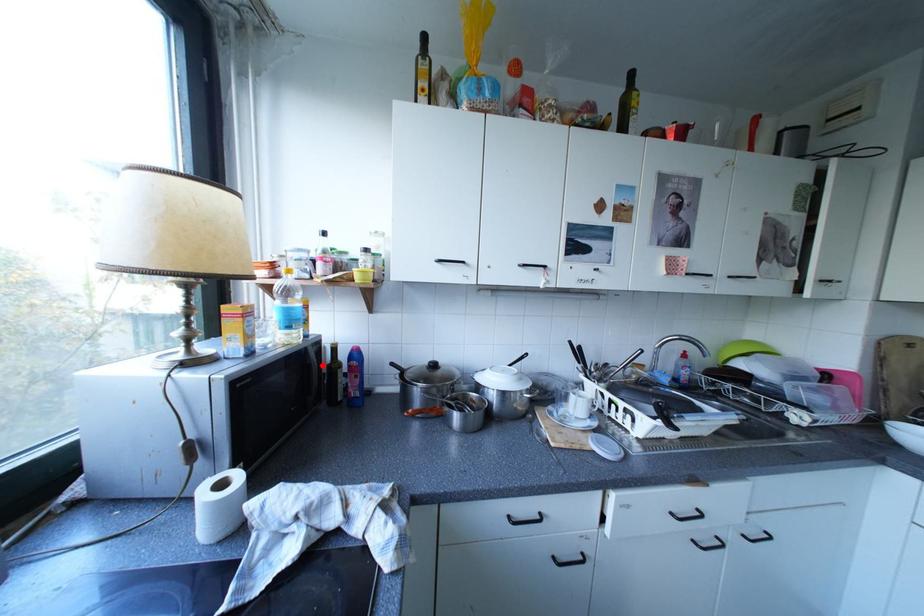
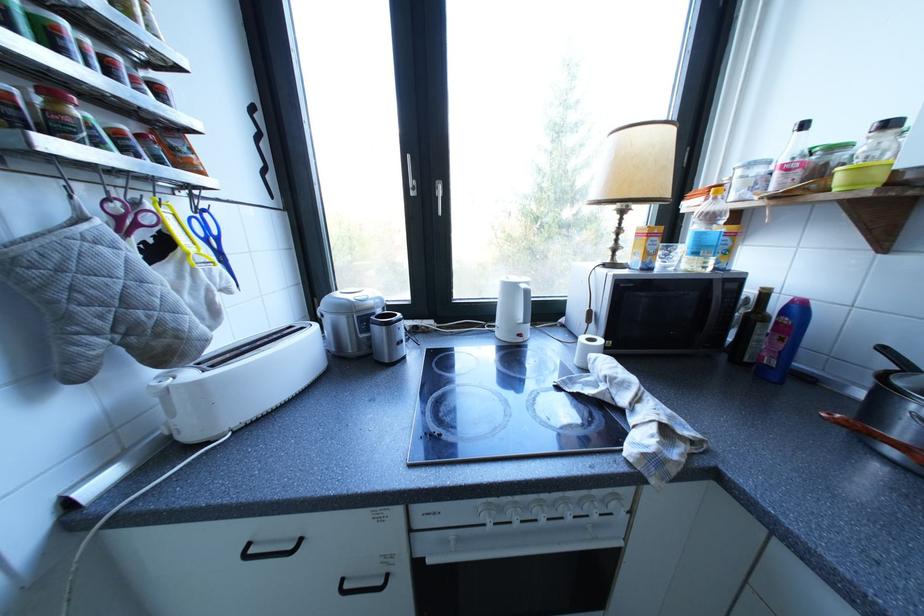
Where in the second image is the point corresponding to the highlighted location from the first image?

(723, 301)